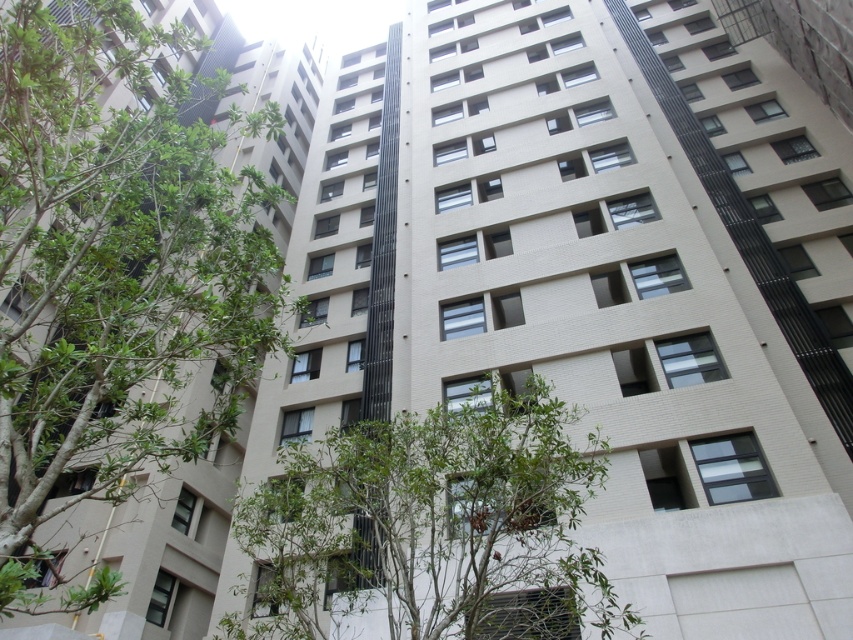
Does green leafy tree at left have a greater height compared to green leafy tree at lower center?

Indeed, green leafy tree at left has a greater height compared to green leafy tree at lower center.

Which is more to the left, green leafy tree at left or green leafy tree at lower center?

green leafy tree at left

Between point (15, 45) and point (410, 547), which one is positioned in front?

Point (15, 45) is more forward.

The height and width of the screenshot is (640, 853). I want to click on green leafy tree at left, so click(x=115, y=273).